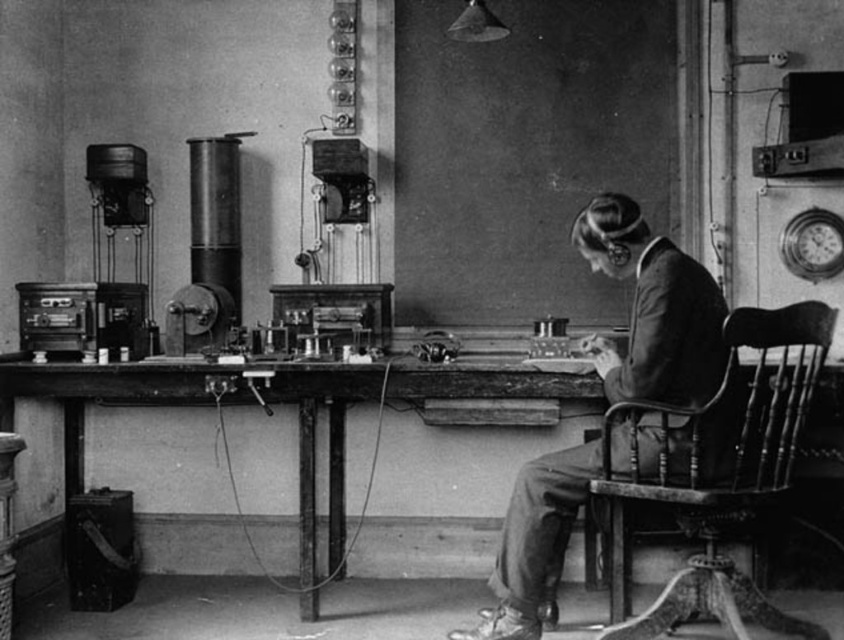
You are organizing a museum exhibit and need to place the smooth leather jacket at center and the wooden table at center in a display case. The display case has limited space. Based on the scene, which object should you prioritize placing first to ensure both fit?

The smooth leather jacket at center occupies less space than the wooden table at center, so you should place the wooden table at center first to ensure there is enough space left for the smooth leather jacket at center.